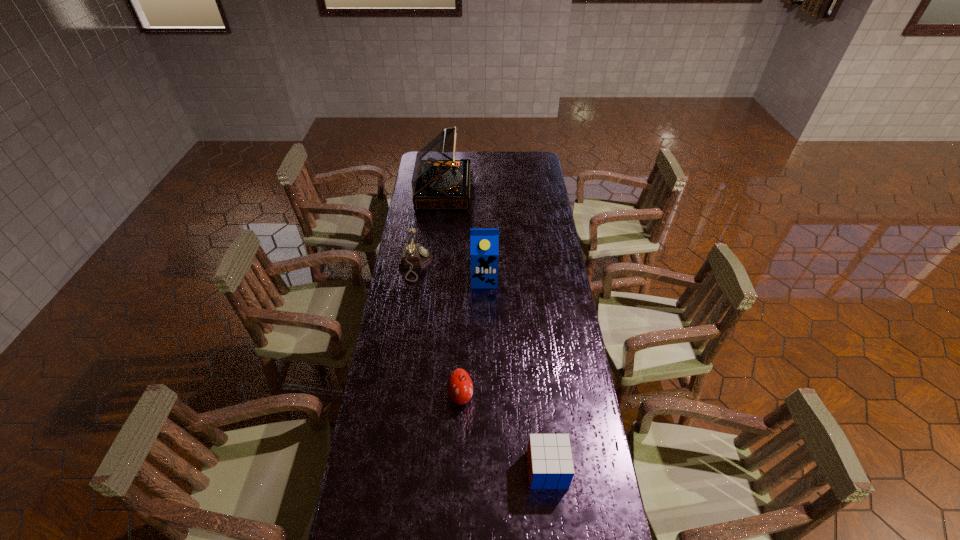
Identify the location of free space between the telephone and the second nearest object. The image size is (960, 540). (438, 330).

Locate an element on the screen. The width and height of the screenshot is (960, 540). free space between the rightmost object and the record player is located at coordinates (495, 330).

The height and width of the screenshot is (540, 960). I want to click on free space between the rightmost object and the telephone, so click(481, 367).

I want to click on vacant point located between the cube and the fourth farthest object, so click(x=504, y=433).

The image size is (960, 540). In order to click on vacant point located between the nearest object and the telephone in this screenshot , I will do `click(481, 367)`.

The height and width of the screenshot is (540, 960). What are the coordinates of `empty location between the telephone and the fourth farthest object` in the screenshot? It's located at (438, 330).

At what (x,y) coordinates should I click in order to perform the action: click on vacant space in between the carton and the farthest object. Please return your answer as a coordinate pair (x, y). This screenshot has height=540, width=960. Looking at the image, I should click on (464, 235).

The width and height of the screenshot is (960, 540). In order to click on free spot between the telephone and the record player in this screenshot , I will do `click(430, 227)`.

Where is `free space between the carton and the apple`? The height and width of the screenshot is (540, 960). free space between the carton and the apple is located at coordinates (472, 338).

Locate an element on the screen. This screenshot has width=960, height=540. object that is the second closest one to the telephone is located at coordinates (439, 181).